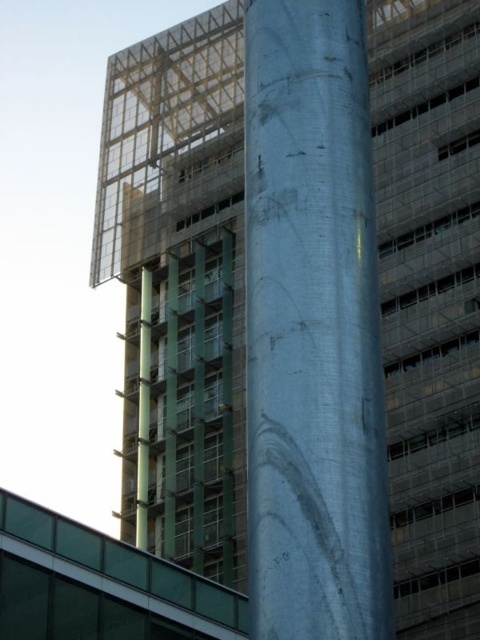
Question: Is the position of metallic silver pole at center more distant than that of green glass pole at center?

Choices:
 (A) no
 (B) yes

Answer: (A)

Question: Is metallic silver pole at center below green glass pole at center?

Choices:
 (A) yes
 (B) no

Answer: (B)

Question: Does metallic silver pole at center have a larger size compared to green glass pole at center?

Choices:
 (A) yes
 (B) no

Answer: (B)

Question: Among these points, which one is nearest to the camera?

Choices:
 (A) (137, 509)
 (B) (327, 237)

Answer: (B)

Question: Which of the following is the closest to the observer?

Choices:
 (A) metallic silver pole at center
 (B) green glass pole at center

Answer: (A)